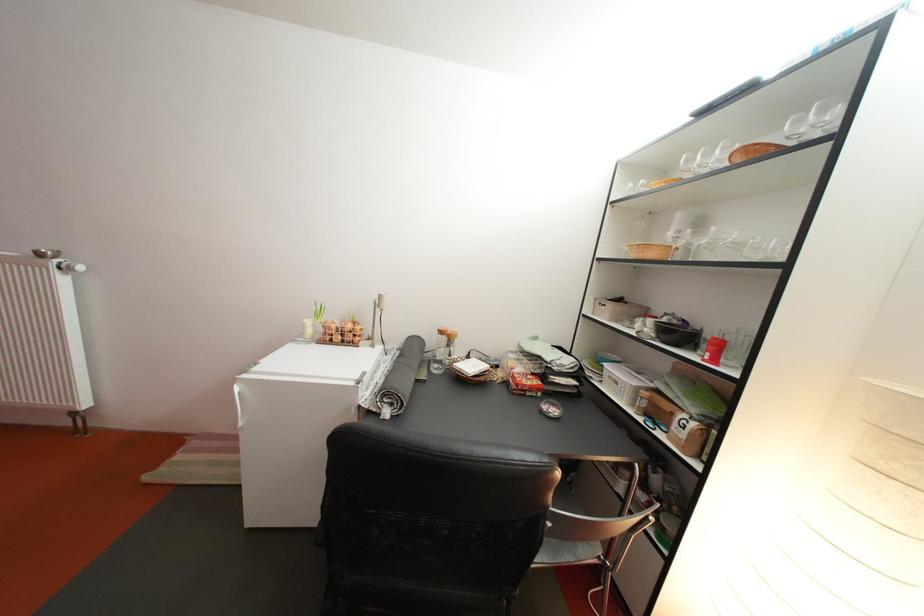
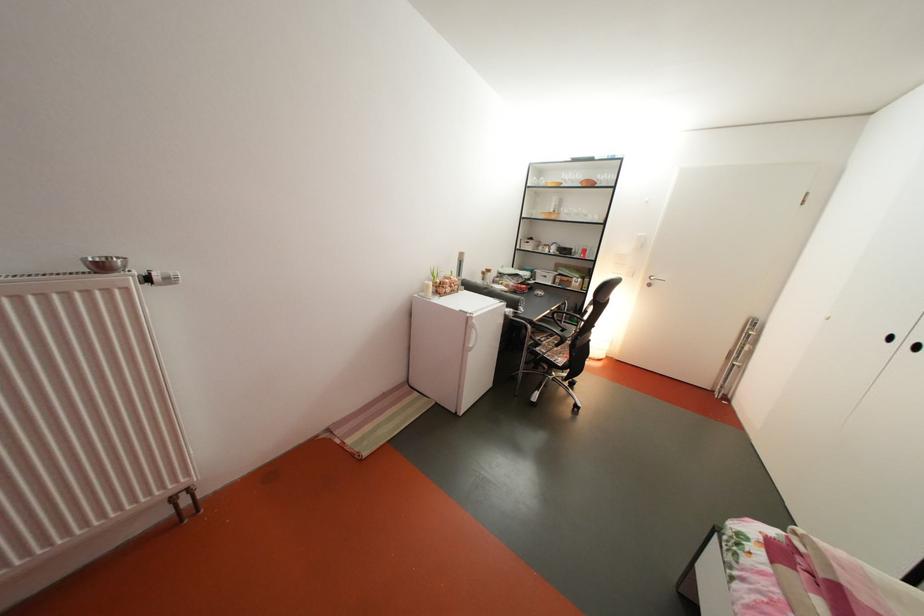
Find the pixel in the second image that matches [314,331] in the first image.

(439, 293)